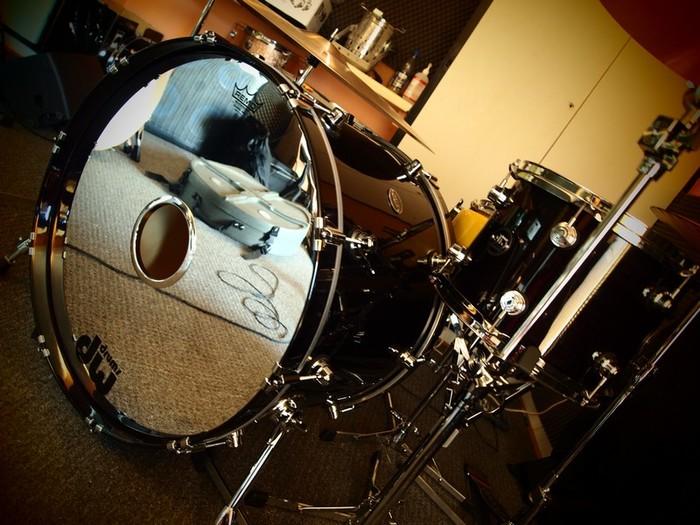
Identify the location of cord. Image resolution: width=700 pixels, height=525 pixels. (61, 86).